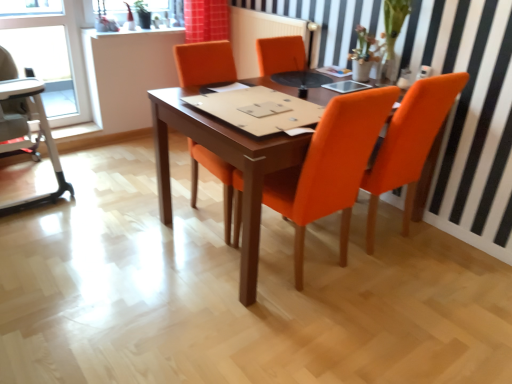
Find the location of a particular element. This screenshot has height=384, width=512. free space on the front side of wooden table at center is located at coordinates (302, 333).